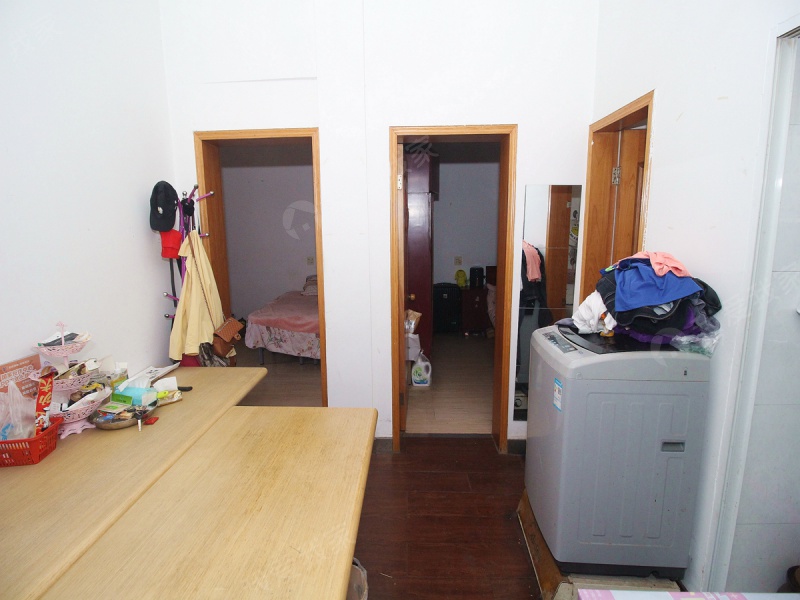
You are a GUI agent. You are given a task and a screenshot of the screen. Output one action in this format:
    pyautogui.click(x=<x>, y=<y>)
    Task: Click on the vertical mirror
    Image resolution: width=800 pixels, height=600 pixels.
    Given the screenshot: What is the action you would take?
    pyautogui.click(x=545, y=262)